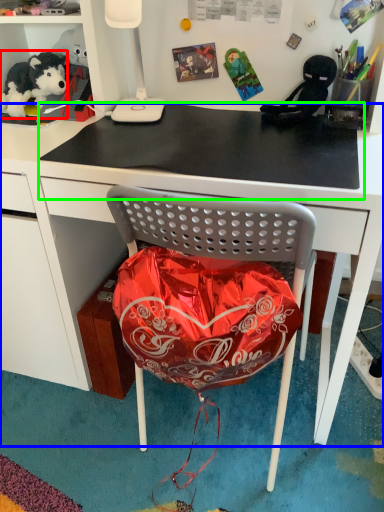
Question: Which object is positioned closest to teddy bear (highlighted by a red box)? Select from desk (highlighted by a blue box) and table top (highlighted by a green box).

Choices:
 (A) desk
 (B) table top

Answer: (B)